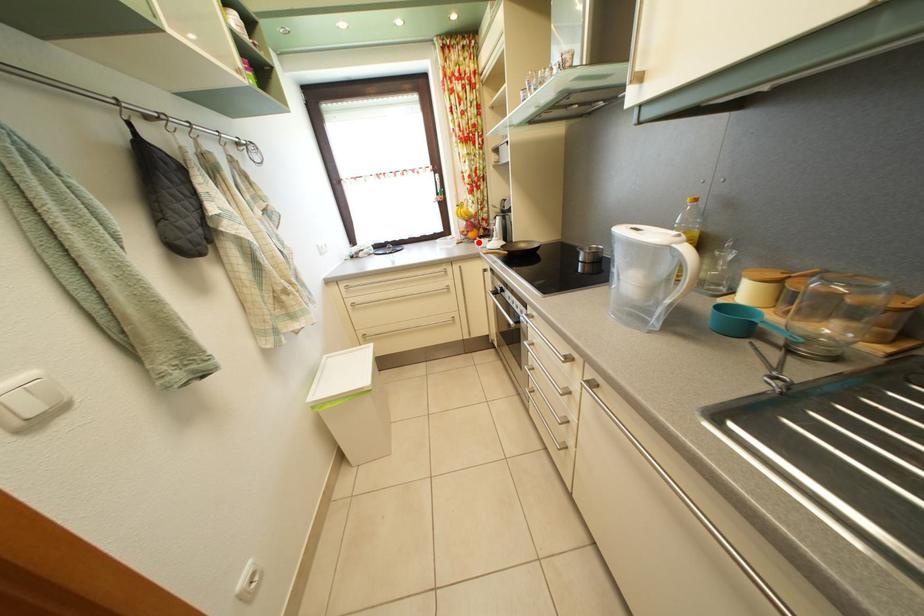
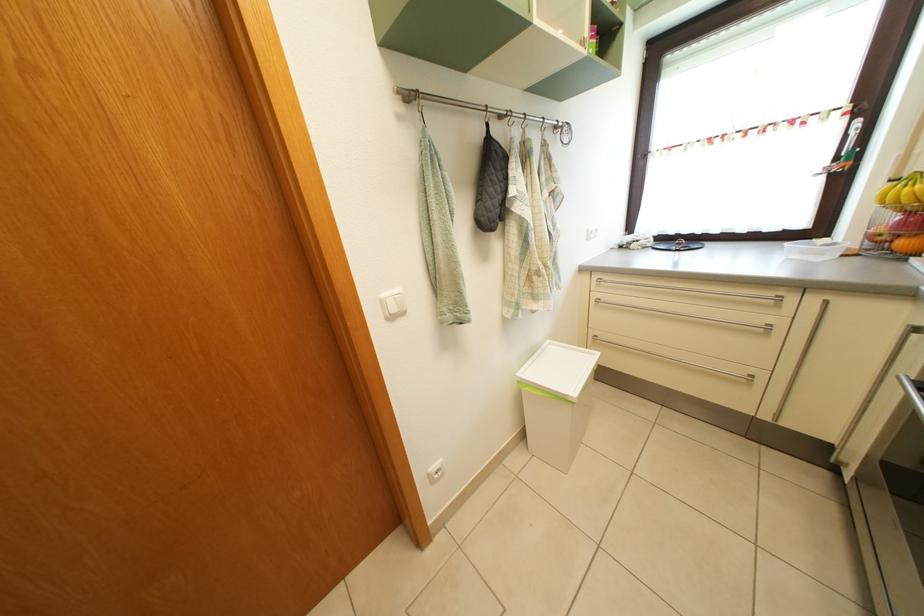
Question: I am providing you with two images of the same scene from different viewpoints. Given a red point in image1, look at the same physical point in image2. Is it:

Choices:
 (A) Closer to the viewpoint
 (B) Farther from the viewpoint

Answer: (B)